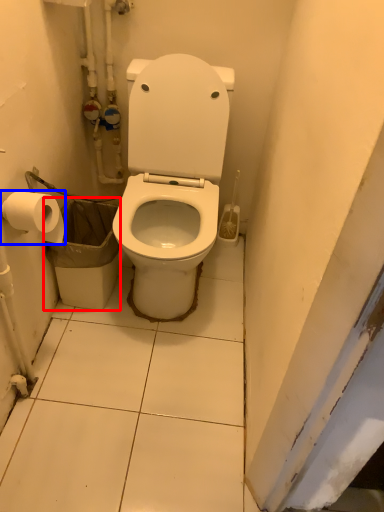
Question: Which object is further to the camera taking this photo, garbage (highlighted by a red box) or toilet paper (highlighted by a blue box)?

Choices:
 (A) garbage
 (B) toilet paper

Answer: (A)